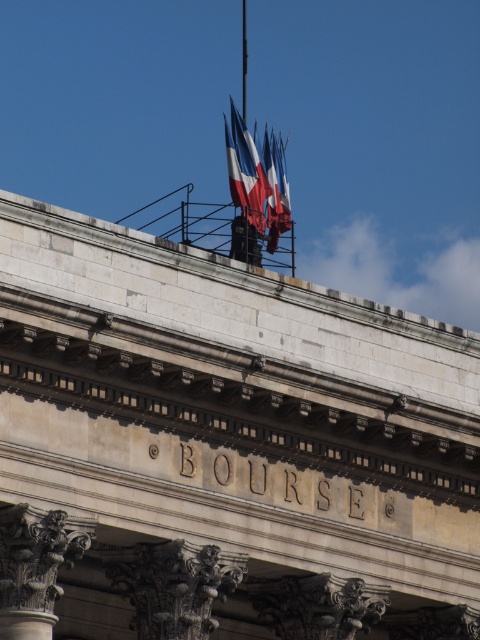
Who is shorter, red-white-blue fabric flag at upper center or polished metallic flag at center?

polished metallic flag at center

Does red-white-blue fabric flag at upper center appear on the left side of polished metallic flag at center?

Indeed, red-white-blue fabric flag at upper center is positioned on the left side of polished metallic flag at center.

I want to click on red-white-blue fabric flag at upper center, so click(x=257, y=179).